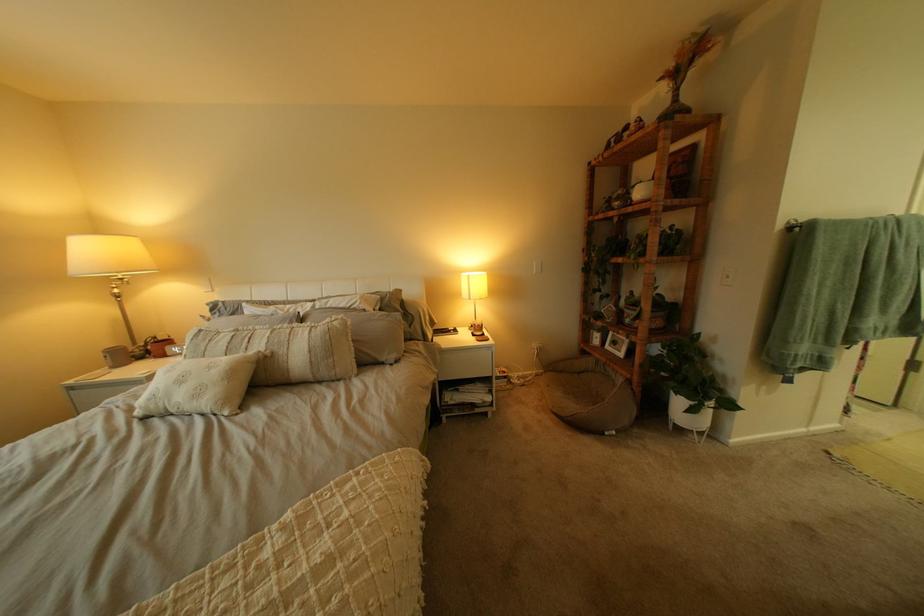
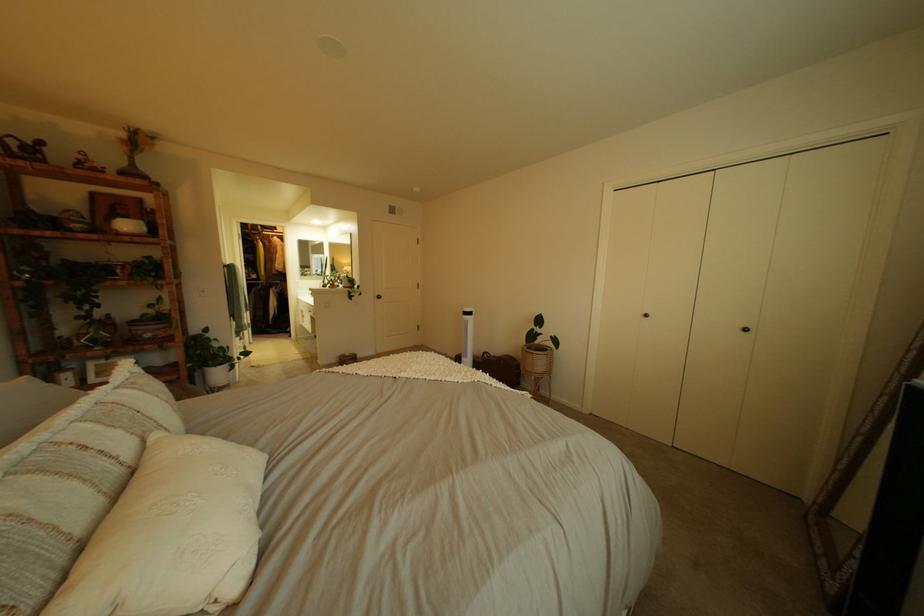
Locate, in the second image, the point that corresponds to [648,203] in the first image.

(132, 232)